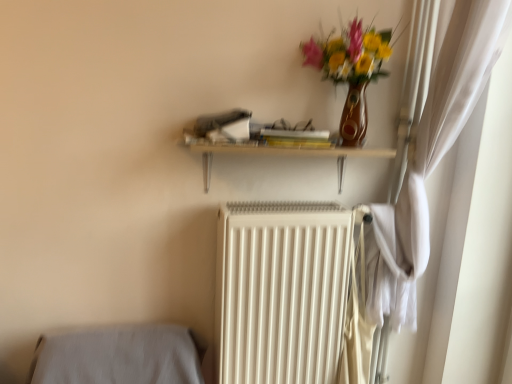
Question: Is white matte radiator at center wider or thinner than wooden shelf at upper center?

Choices:
 (A) wide
 (B) thin

Answer: (A)

Question: Would you say white matte radiator at center is to the left or to the right of wooden shelf at upper center in the picture?

Choices:
 (A) right
 (B) left

Answer: (A)

Question: Considering the real-world distances, which object is farthest from the wooden shelf at upper center?

Choices:
 (A) matte brown vase with flowers at upper right
 (B) white matte radiator at center

Answer: (B)

Question: Which of these objects is positioned farthest from the wooden shelf at upper center?

Choices:
 (A) white matte radiator at center
 (B) matte brown vase with flowers at upper right

Answer: (A)